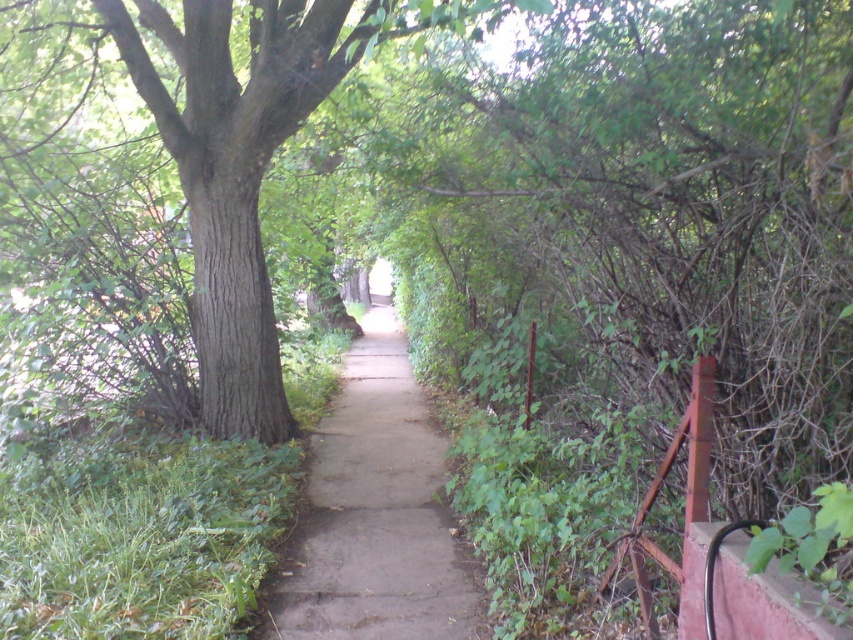
Who is higher up, green rough bark tree at center or dull concrete pavement at center?

green rough bark tree at center is above.

Which is in front, point (224, 260) or point (387, 376)?

Point (224, 260) is more forward.

Find the location of a particular element. This screenshot has height=640, width=853. green rough bark tree at center is located at coordinates (247, 161).

Identify the location of green rough bark tree at center. The width and height of the screenshot is (853, 640). (247, 161).